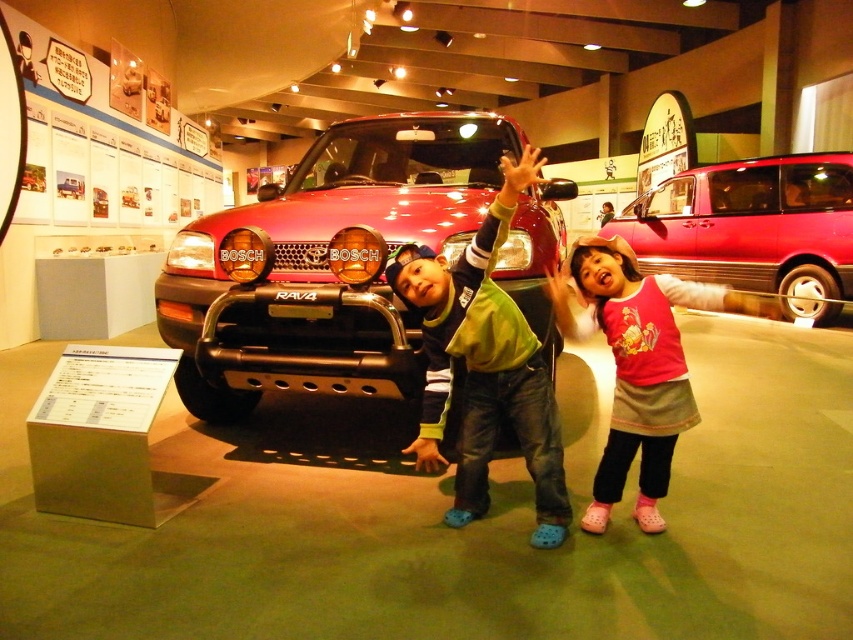
What is the 2D coordinate of the green denim jeans at center?

The 2D coordinate of the green denim jeans at center is at point (485, 365).

You are a tour guide giving a tour of the car museum. You notice a visitor asking about the position of the shiny red suv at center and the green denim jeans at center. How would you describe their positions relative to each other?

The shiny red suv at center is positioned to the left of the green denim jeans at center.

You are a photographer setting up a shoot in the car museum. You need to position a 10cm wide decorative box between the green denim jeans at center and the metallic red pickup truck at right. Will the space between them be wide enough to fit the box?

The green denim jeans at center is thinner than the metallic red pickup truck at right, so the space between them is sufficient to fit a 10cm wide decorative box.